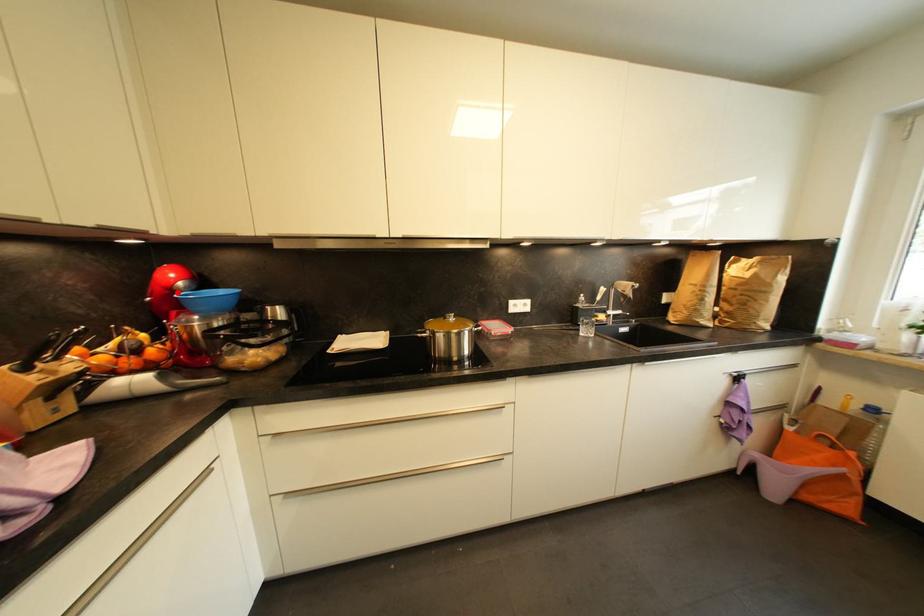
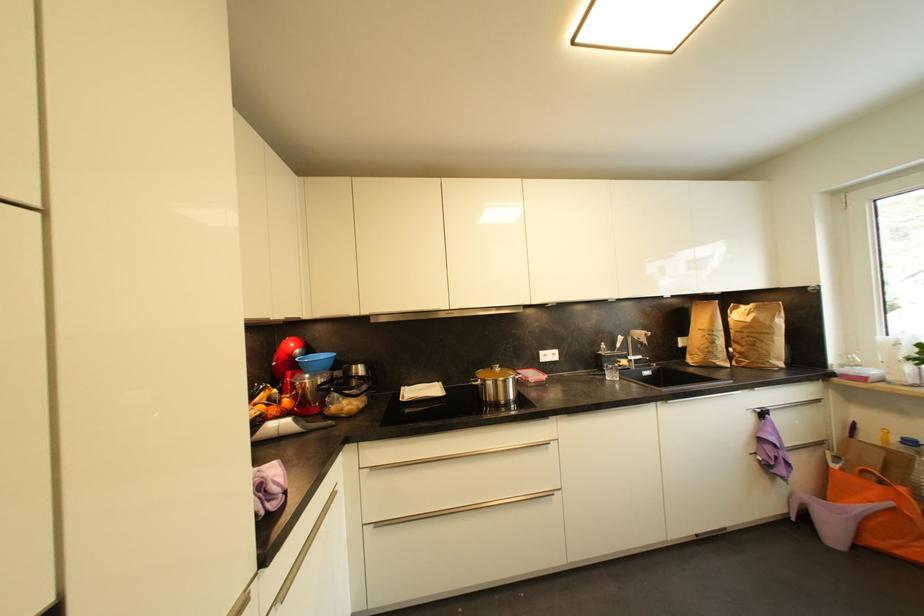
Find the pixel in the second image that matches the highlighted location in the first image.

(297, 359)